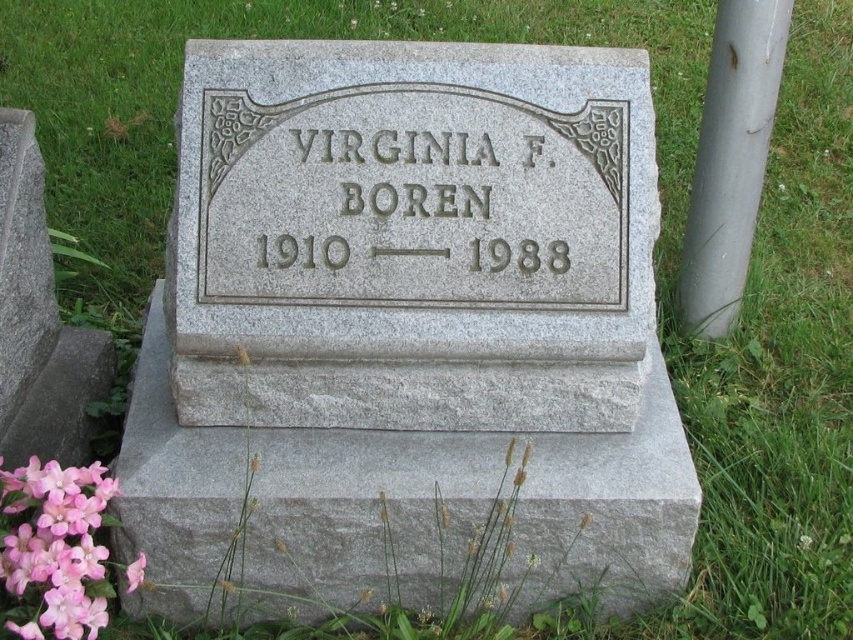
Between gray metallic pole at right and pink matte flower at lower left, which one appears on the right side from the viewer's perspective?

Positioned to the right is gray metallic pole at right.

Is gray metallic pole at right further to camera compared to pink matte flower at lower left?

Yes, it is behind pink matte flower at lower left.

Is point (778, 10) in front of point (73, 506)?

No.

Identify the location of gray metallic pole at right. (730, 161).

Is gray granite inscription at center further to camera compared to gray metallic pole at right?

No.

Is gray granite inscription at center wider than gray metallic pole at right?

Indeed, gray granite inscription at center has a greater width compared to gray metallic pole at right.

Which is in front, point (541, 221) or point (715, 324)?

Positioned in front is point (541, 221).

Where is `gray granite inscription at center`? gray granite inscription at center is located at coordinates (404, 198).

Does gray granite inscription at center come behind pink matte flower at lower left?

Yes, gray granite inscription at center is further from the viewer.

Between gray granite inscription at center and pink matte flower at lower left, which one appears on the right side from the viewer's perspective?

gray granite inscription at center

Find the location of a particular element. The width and height of the screenshot is (853, 640). gray granite inscription at center is located at coordinates (404, 198).